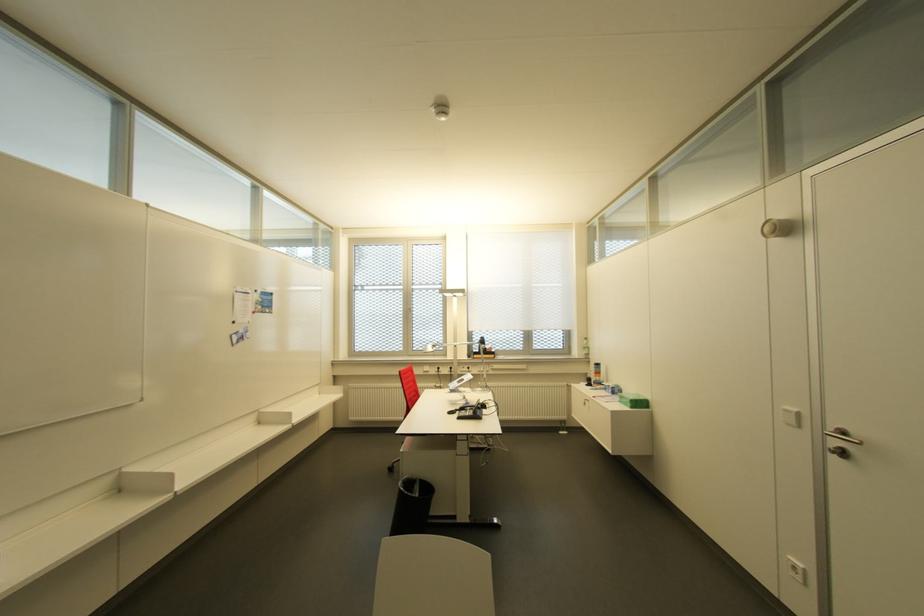
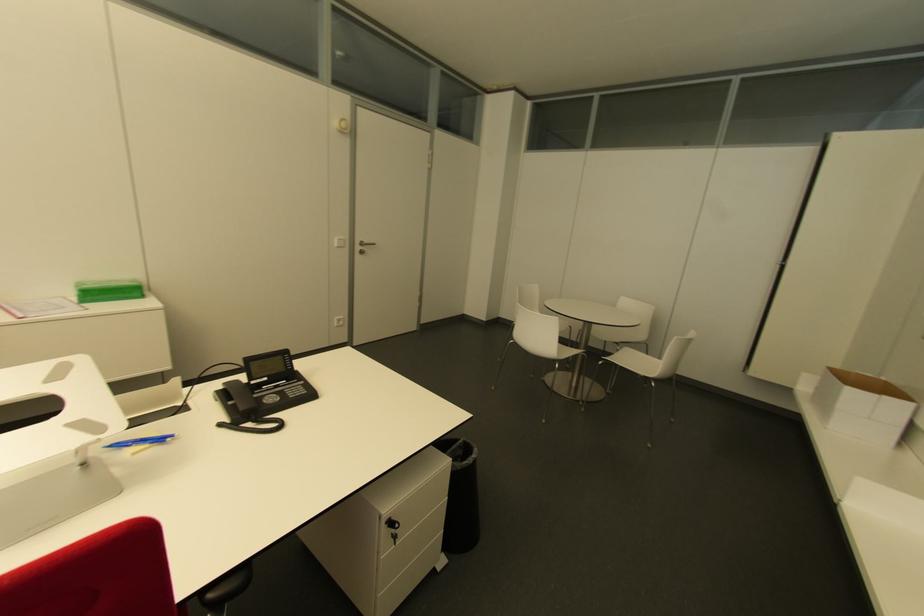
In the second image, find the point that corresponds to point (842, 455) in the first image.

(360, 253)